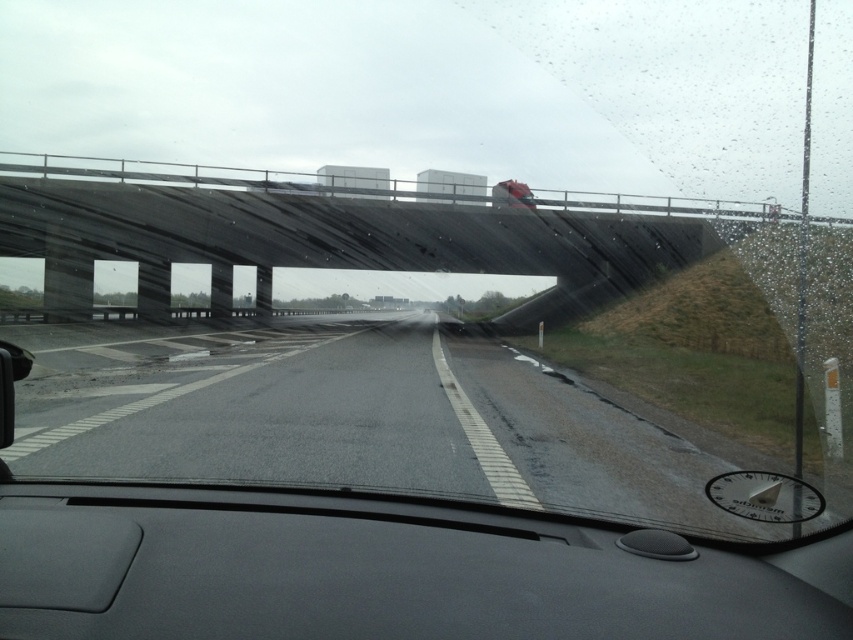
Question: In this image, where is black matte dashboard at center located relative to dark gray concrete bridge at upper center?

Choices:
 (A) above
 (B) below

Answer: (B)

Question: Is black matte dashboard at center smaller than dark gray concrete bridge at upper center?

Choices:
 (A) yes
 (B) no

Answer: (A)

Question: Among these points, which one is farthest from the camera?

Choices:
 (A) (486, 444)
 (B) (479, 252)
 (C) (514, 572)

Answer: (B)

Question: Considering the real-world distances, which object is closest to the black matte dashboard at center?

Choices:
 (A) dark gray concrete bridge at upper center
 (B) asphalt road at center

Answer: (B)

Question: Which object appears farthest from the camera in this image?

Choices:
 (A) asphalt road at center
 (B) black matte dashboard at center

Answer: (A)

Question: Can you confirm if asphalt road at center is wider than dark gray concrete bridge at upper center?

Choices:
 (A) no
 (B) yes

Answer: (A)